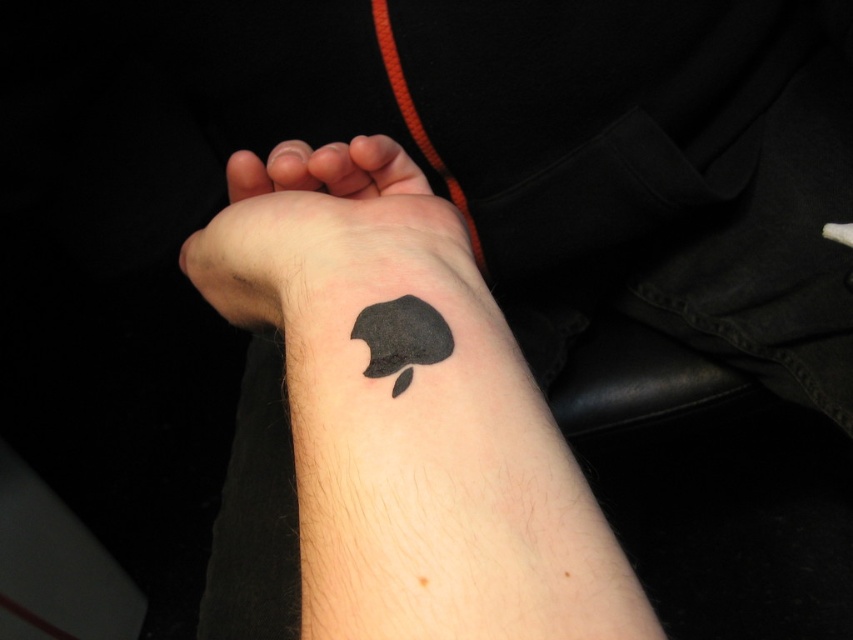
Which is in front, point (556, 547) or point (396, 305)?

Point (556, 547)

Who is higher up, black matte tattoo at lower center or black matte apple at lower center?

Positioned higher is black matte apple at lower center.

Is point (572, 636) less distant than point (421, 353)?

That is True.

Where is `black matte tattoo at lower center`? The image size is (853, 640). black matte tattoo at lower center is located at coordinates (408, 416).

Can you confirm if black ink tattoo at lower center is positioned to the right of black matte apple at lower center?

Incorrect, black ink tattoo at lower center is not on the right side of black matte apple at lower center.

Does black ink tattoo at lower center have a lesser width compared to black matte apple at lower center?

In fact, black ink tattoo at lower center might be wider than black matte apple at lower center.

At what (x,y) coordinates should I click in order to perform the action: click on black ink tattoo at lower center. Please return your answer as a coordinate pair (x, y). Looking at the image, I should click on (329, 240).

Find the location of a particular element. This screenshot has width=853, height=640. black ink tattoo at lower center is located at coordinates (329, 240).

Between black matte tattoo at lower center and black ink tattoo at lower center, which one has less height?

Standing shorter between the two is black ink tattoo at lower center.

Who is positioned more to the left, black matte tattoo at lower center or black ink tattoo at lower center?

black matte tattoo at lower center is more to the left.

Identify the location of black matte tattoo at lower center. (408, 416).

Identify the location of black matte tattoo at lower center. (408, 416).